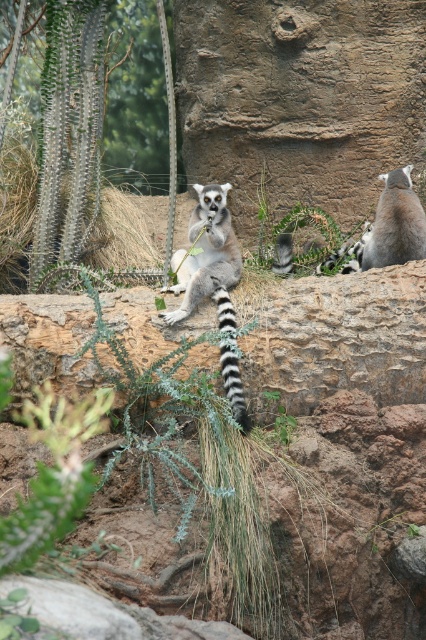
You are standing at the camera position and want to throw a small treat to the point marked as point (206, 228). If your throwing range is 4 meters, will you be able to reach that point?

The distance between point (206, 228) and the camera is 4.34 meters, which exceeds your throwing range of 4 meters. Therefore, you won